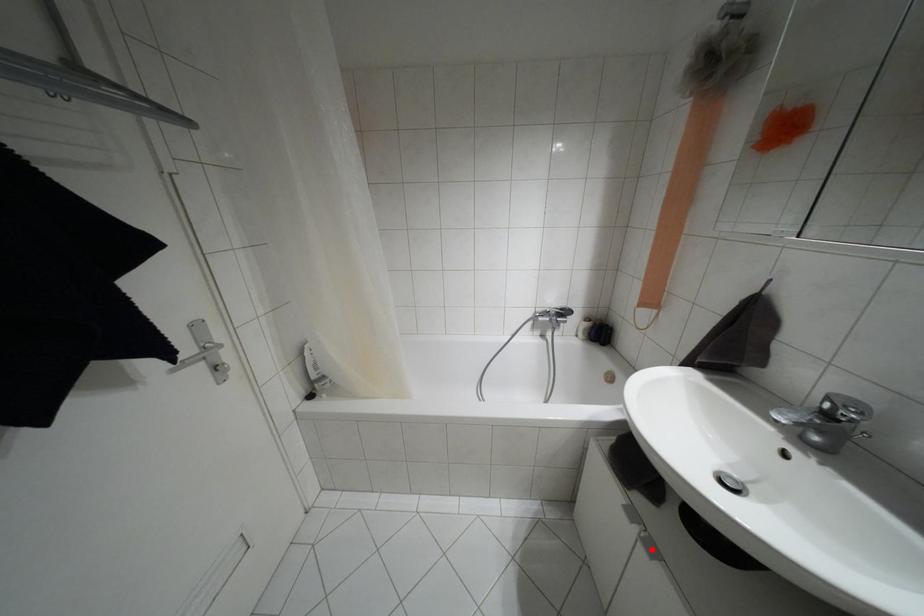
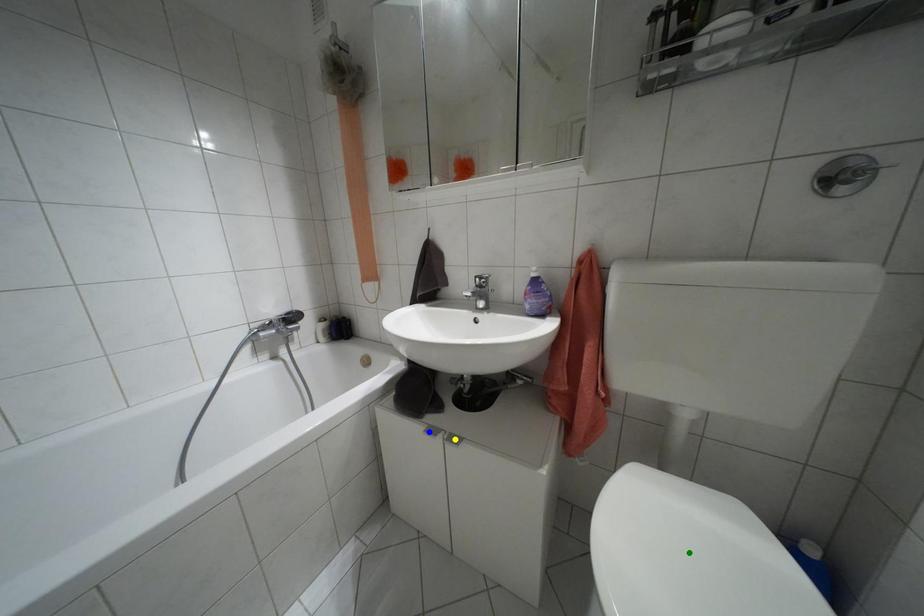
Question: I am providing you with two images of the same scene from different viewpoints. A red point is marked on the first image. You are given multiple points on the second image. Which spot in image 2 lines up with the point in image 1?

Choices:
 (A) yellow point
 (B) green point
 (C) blue point

Answer: (A)